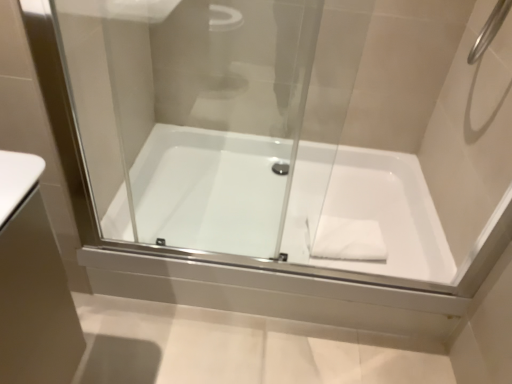
At what (x,y) coordinates should I click in order to perform the action: click on white matte hand towel at center. Please return your answer as a coordinate pair (x, y). This screenshot has width=512, height=384. Looking at the image, I should click on (347, 240).

Locate an element on the screen. white matte hand towel at center is located at coordinates (347, 240).

Between white glossy bathtub at center and transparent glass door at center, which one is positioned in front?

transparent glass door at center is in front.

From a real-world perspective, is white glossy bathtub at center positioned under transparent glass door at center based on gravity?

Yes, from a real-world perspective, white glossy bathtub at center is under transparent glass door at center.

Locate an element on the screen. The height and width of the screenshot is (384, 512). glass door above the white glossy bathtub at center (from a real-world perspective) is located at coordinates (207, 110).

Is white glossy bathtub at center beside transparent glass door at center?

There is a gap between white glossy bathtub at center and transparent glass door at center.

In the image, is transparent glass door at center on the left side or the right side of white glossy bathtub at center?

transparent glass door at center is to the right of white glossy bathtub at center.

Is white glossy bathtub at center completely or partially inside transparent glass door at center?

No, white glossy bathtub at center is not surrounded by transparent glass door at center.

In the scene shown: From a real-world perspective, is transparent glass door at center positioned under white glossy bathtub at center based on gravity?

Incorrect, from a real-world perspective, transparent glass door at center is higher than white glossy bathtub at center.

Is transparent glass door at center with white glossy bathtub at center?

No, transparent glass door at center is not touching white glossy bathtub at center.

Can you tell me how much white matte hand towel at center and transparent glass door at center differ in facing direction?

white matte hand towel at center and transparent glass door at center are facing 3.43 degrees away from each other.

Locate an element on the screen. The width and height of the screenshot is (512, 384). glass door that appears in front of the white matte hand towel at center is located at coordinates (207, 110).

Based on the photo, is white matte hand towel at center completely or partially outside of transparent glass door at center?

That's correct, white matte hand towel at center is outside of transparent glass door at center.

Is the position of white matte hand towel at center more distant than that of transparent glass door at center?

That is True.

From a real-world perspective, is white glossy bathtub at center below white matte hand towel at center?

Correct, in the physical world, white glossy bathtub at center is lower than white matte hand towel at center.

Is white matte hand towel at center a part of white glossy bathtub at center?

Indeed, white matte hand towel at center is located within white glossy bathtub at center.

Considering the sizes of objects white glossy bathtub at center and white matte hand towel at center in the image provided, who is taller, white glossy bathtub at center or white matte hand towel at center?

white glossy bathtub at center is taller.

Is white glossy bathtub at center positioned with its back to white matte hand towel at center?

No, white glossy bathtub at center is not facing away from white matte hand towel at center.

Based on their sizes in the image, would you say white matte hand towel at center is bigger or smaller than white glossy bathtub at center?

white matte hand towel at center is smaller than white glossy bathtub at center.

Between white matte hand towel at center and white glossy bathtub at center, which one has more height?

With more height is white glossy bathtub at center.

Consider the image. From the image's perspective, is white matte hand towel at center located above or below white glossy bathtub at center?

Clearly, from the image's perspective, white matte hand towel at center is below white glossy bathtub at center.

Does transparent glass door at center lie behind white matte hand towel at center?

No, transparent glass door at center is closer to the camera.

Is transparent glass door at center at the right side of white matte hand towel at center?

Incorrect, transparent glass door at center is not on the right side of white matte hand towel at center.

From a real-world perspective, between transparent glass door at center and white matte hand towel at center, who is vertically higher?

In real-world perspective, transparent glass door at center is above.

From the image's perspective, is transparent glass door at center above or below white matte hand towel at center?

transparent glass door at center is above white matte hand towel at center.

Identify the location of glass door on the right of white glossy bathtub at center. Image resolution: width=512 pixels, height=384 pixels. (207, 110).

This screenshot has height=384, width=512. I want to click on bathtub below the transparent glass door at center (from a real-world perspective), so click(x=208, y=190).

Considering their positions, is white glossy bathtub at center positioned closer to transparent glass door at center than white matte hand towel at center?

Based on the image, white glossy bathtub at center appears to be nearer to transparent glass door at center.

Looking at this image, when comparing their distances from transparent glass door at center, does white matte hand towel at center or white glossy bathtub at center seem closer?

Among the two, white glossy bathtub at center is located nearer to transparent glass door at center.

Estimate the real-world distances between objects in this image. Which object is closer to white glossy bathtub at center, white matte hand towel at center or transparent glass door at center?

Based on the image, transparent glass door at center appears to be nearer to white glossy bathtub at center.

Estimate the real-world distances between objects in this image. Which object is further from white matte hand towel at center, transparent glass door at center or white glossy bathtub at center?

transparent glass door at center is positioned further to the anchor white matte hand towel at center.

Which object lies nearer to the anchor point white matte hand towel at center, white glossy bathtub at center or transparent glass door at center?

white glossy bathtub at center is positioned closer to the anchor white matte hand towel at center.

From the image, which object appears to be farther from white glossy bathtub at center, transparent glass door at center or white matte hand towel at center?

white matte hand towel at center lies further to white glossy bathtub at center than the other object.

Identify the location of bathtub between transparent glass door at center and white matte hand towel at center in the front-back direction. (208, 190).